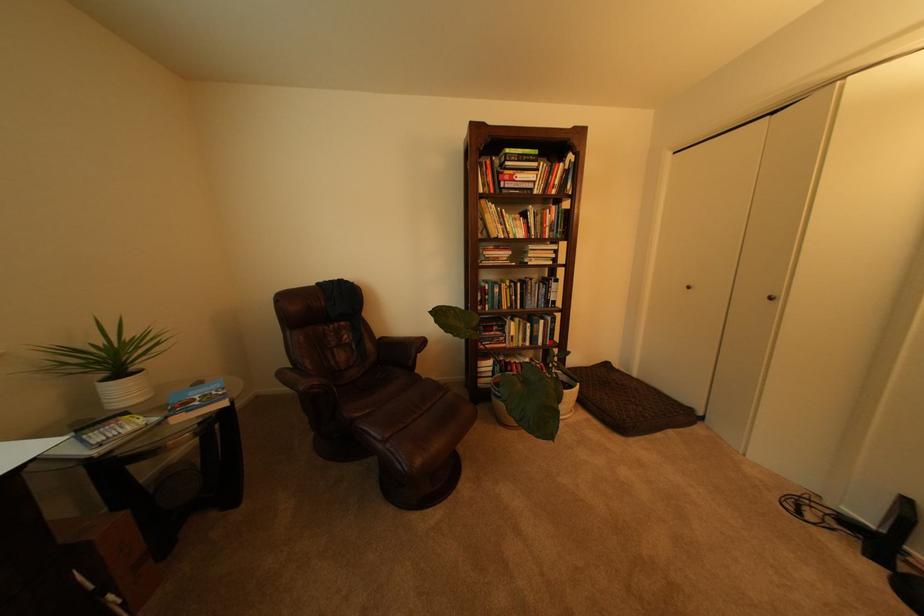
The width and height of the screenshot is (924, 616). I want to click on brown chair sitting surface, so click(397, 413).